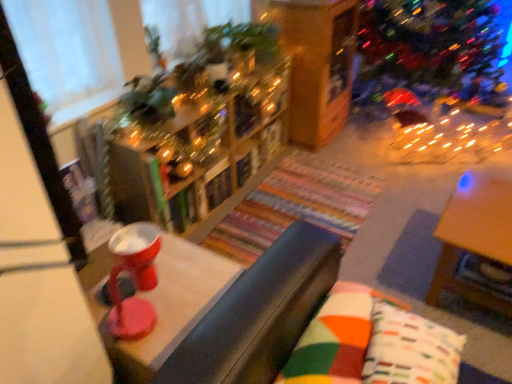
Question: From the image's perspective, is wooden table at right, the 1th table when ordered from right to left, located above or below wooden bookshelf at center?

Choices:
 (A) below
 (B) above

Answer: (A)

Question: Considering the positions of wooden table at right, acting as the 2th table starting from the left, and wooden bookshelf at center in the image, is wooden table at right, acting as the 2th table starting from the left, bigger or smaller than wooden bookshelf at center?

Choices:
 (A) small
 (B) big

Answer: (B)

Question: Estimate the real-world distances between objects in this image. Which object is closer to the wooden table at right, the 1th table when ordered from right to left?

Choices:
 (A) wooden bookshelf at center
 (B) multicolored fabric pillow at lower right, which ranks as the 2th pillow in left-to-right order
 (C) shiny plastic bowl at center, the 2th table in the right-to-left sequence
 (D) wooden bookshelf at center
 (E) multicolored fabric pillow at center, the 1th pillow positioned from the left

Answer: (B)

Question: Which object is the farthest from the wooden bookshelf at center?

Choices:
 (A) multicolored fabric pillow at lower right, acting as the first pillow starting from the right
 (B) shiny plastic bowl at center, the 2th table in the right-to-left sequence
 (C) wooden table at right, the 1th table when ordered from right to left
 (D) multicolored fabric pillow at center, which is the second pillow in right-to-left order
 (E) wooden bookshelf at center

Answer: (A)